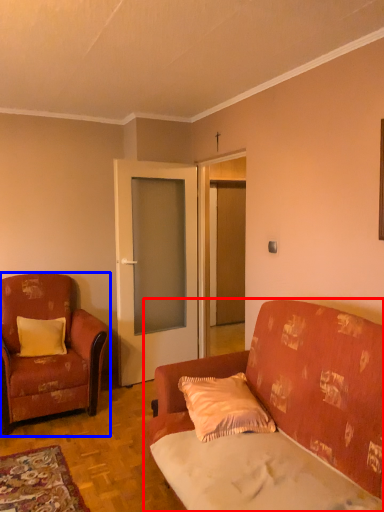
Question: Among these objects, which one is farthest to the camera, studio couch (highlighted by a red box) or chair (highlighted by a blue box)?

Choices:
 (A) studio couch
 (B) chair

Answer: (B)